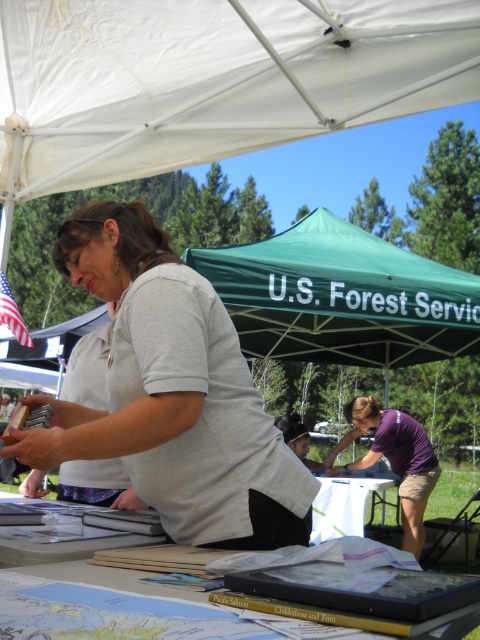
Who is shorter, white fabric canopy at upper center or green fabric canopy at center?

white fabric canopy at upper center

Between point (324, 51) and point (330, 298), which one is positioned in front?

Positioned in front is point (324, 51).

The image size is (480, 640). In order to click on white fabric canopy at upper center in this screenshot , I will do `click(212, 80)`.

Locate an element on the screen. The width and height of the screenshot is (480, 640). white fabric canopy at upper center is located at coordinates (212, 80).

Describe the element at coordinates (212, 80) in the screenshot. I see `white fabric canopy at upper center` at that location.

Looking at this image, does white fabric canopy at upper center have a smaller size compared to gray matte shirt at center?

No, white fabric canopy at upper center is not smaller than gray matte shirt at center.

Is point (120, 122) closer to camera compared to point (177, 481)?

No, (120, 122) is behind (177, 481).

What are the coordinates of `white fabric canopy at upper center` in the screenshot? It's located at (212, 80).

From the picture: Who is more distant from viewer, (265,250) or (396,420)?

Point (396,420)

Does point (354, 285) lie behind point (430, 470)?

That is False.

Locate an element on the screen. The image size is (480, 640). green fabric canopy at center is located at coordinates (342, 296).